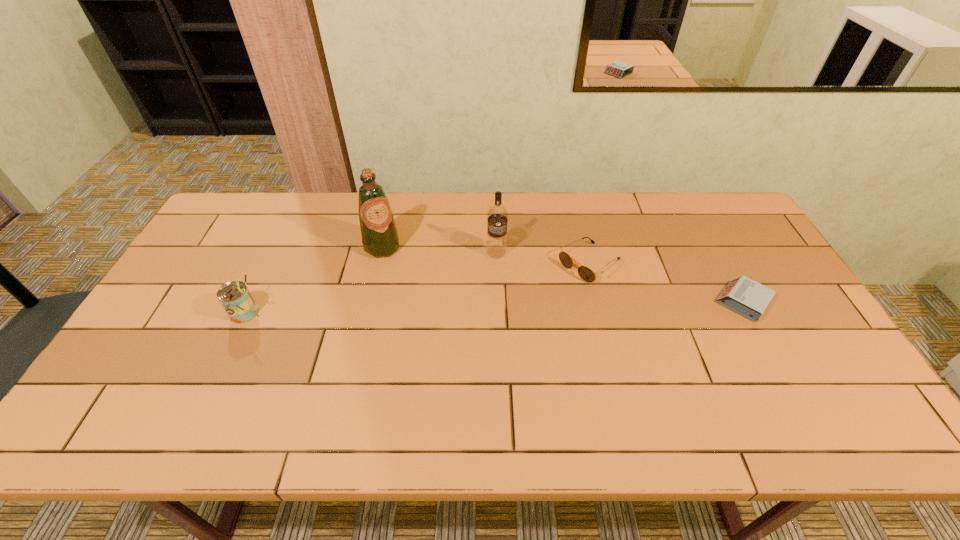
You are a GUI agent. You are given a task and a screenshot of the screen. Output one action in this format:
    pyautogui.click(x=<x>, y=<y>)
    Task: Click on the leftmost object
    
    Given the screenshot: What is the action you would take?
    pyautogui.click(x=236, y=299)

This screenshot has height=540, width=960. What are the coordinates of `can` in the screenshot? It's located at (236, 299).

I want to click on the rightmost object, so click(745, 296).

Where is `the shortest object`? This screenshot has width=960, height=540. the shortest object is located at coordinates (745, 296).

Find the location of a particular element. The image size is (960, 540). vodka is located at coordinates (497, 216).

You are a GUI agent. You are given a task and a screenshot of the screen. Output one action in this format:
    pyautogui.click(x=<x>, y=<y>)
    Task: Click on the third object from left to right
    
    Given the screenshot: What is the action you would take?
    pyautogui.click(x=497, y=216)

Locate an element on the screen. The image size is (960, 540). the fourth object from right to left is located at coordinates (380, 239).

Where is `olive oil`? The image size is (960, 540). olive oil is located at coordinates (x=380, y=239).

The width and height of the screenshot is (960, 540). I want to click on the second shortest object, so click(x=585, y=273).

Locate an element on the screen. the second object from right to left is located at coordinates (585, 273).